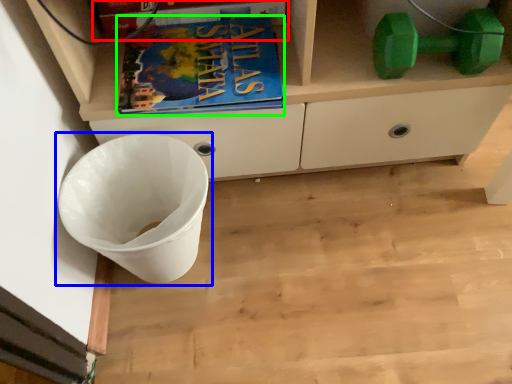
Question: Which object is positioned farthest from paperback book (highlighted by a red box)? Select from waste container (highlighted by a blue box) and book (highlighted by a green box).

Choices:
 (A) waste container
 (B) book

Answer: (A)